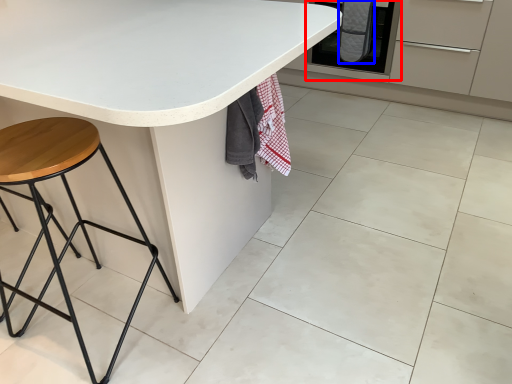
Question: Among these objects, which one is farthest to the camera, oven (highlighted by a red box) or blanket (highlighted by a blue box)?

Choices:
 (A) oven
 (B) blanket

Answer: (B)